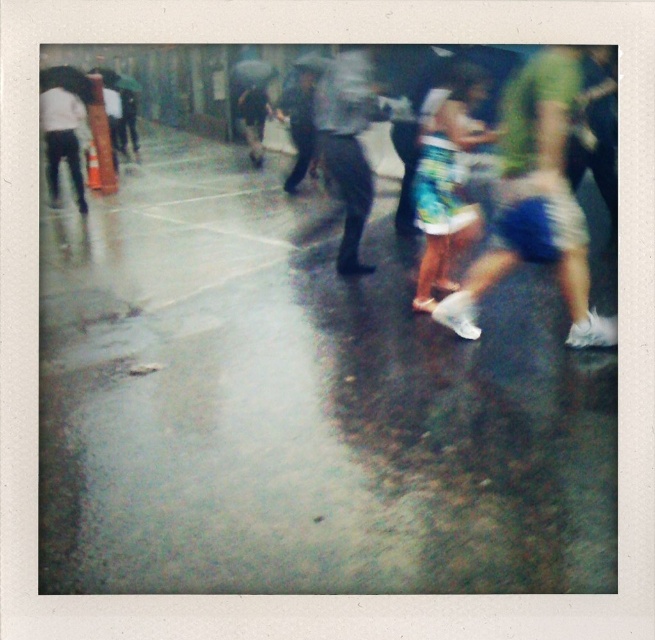
Does wet asphalt pavement at center have a greater width compared to dark gray fabric umbrella at center?

Indeed, wet asphalt pavement at center has a greater width compared to dark gray fabric umbrella at center.

Can you confirm if wet asphalt pavement at center is bigger than dark gray fabric umbrella at center?

Yes.

What do you see at coordinates (303, 406) in the screenshot? This screenshot has width=655, height=640. I see `wet asphalt pavement at center` at bounding box center [303, 406].

The height and width of the screenshot is (640, 655). I want to click on wet asphalt pavement at center, so click(303, 406).

Is point (66, 132) less distant than point (250, 150)?

Yes, point (66, 132) is closer to viewer.

What are the coordinates of `matte black pants at left` in the screenshot? It's located at (62, 134).

In the scene shown: Can you confirm if wet asphalt pavement at center is thinner than blue denim shorts at center?

No, wet asphalt pavement at center is not thinner than blue denim shorts at center.

Can you confirm if wet asphalt pavement at center is positioned to the right of blue denim shorts at center?

No, wet asphalt pavement at center is not to the right of blue denim shorts at center.

What do you see at coordinates (303, 406) in the screenshot? I see `wet asphalt pavement at center` at bounding box center [303, 406].

Where is `wet asphalt pavement at center`? The width and height of the screenshot is (655, 640). wet asphalt pavement at center is located at coordinates (303, 406).